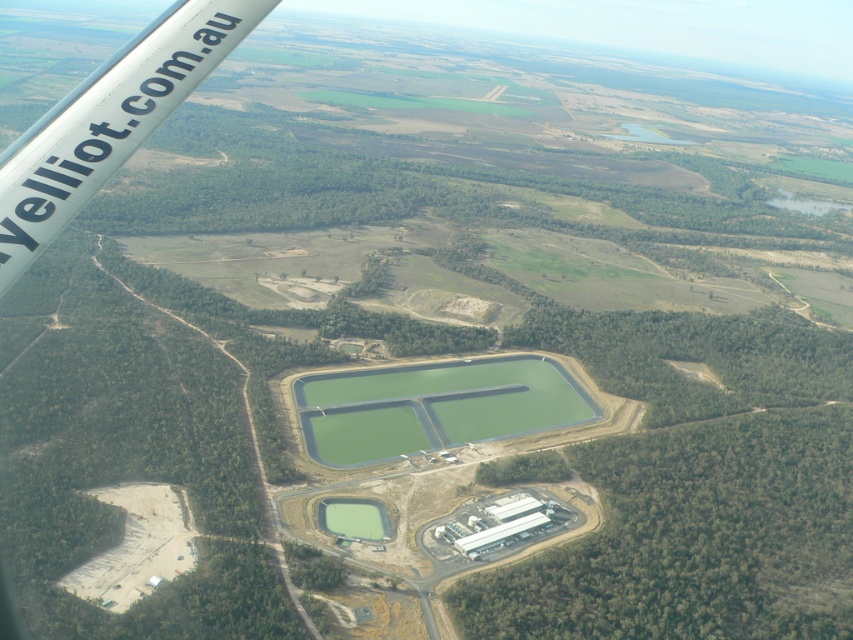
Who is taller, white glossy wing at upper left or green liquid at center?

Standing taller between the two is white glossy wing at upper left.

Can you confirm if white glossy wing at upper left is smaller than green liquid at center?

Actually, white glossy wing at upper left might be larger than green liquid at center.

Where is `white glossy wing at upper left`? white glossy wing at upper left is located at coordinates (109, 122).

Which is below, white glossy wing at upper left or green concrete water at center?

green concrete water at center

Does white glossy wing at upper left have a larger size compared to green concrete water at center?

No, white glossy wing at upper left is not bigger than green concrete water at center.

This screenshot has height=640, width=853. Find the location of `white glossy wing at upper left`. white glossy wing at upper left is located at coordinates (109, 122).

Looking at this image, measure the distance between green concrete water at center and camera.

green concrete water at center and camera are 334.43 meters apart from each other.

Identify the location of green concrete water at center. (432, 406).